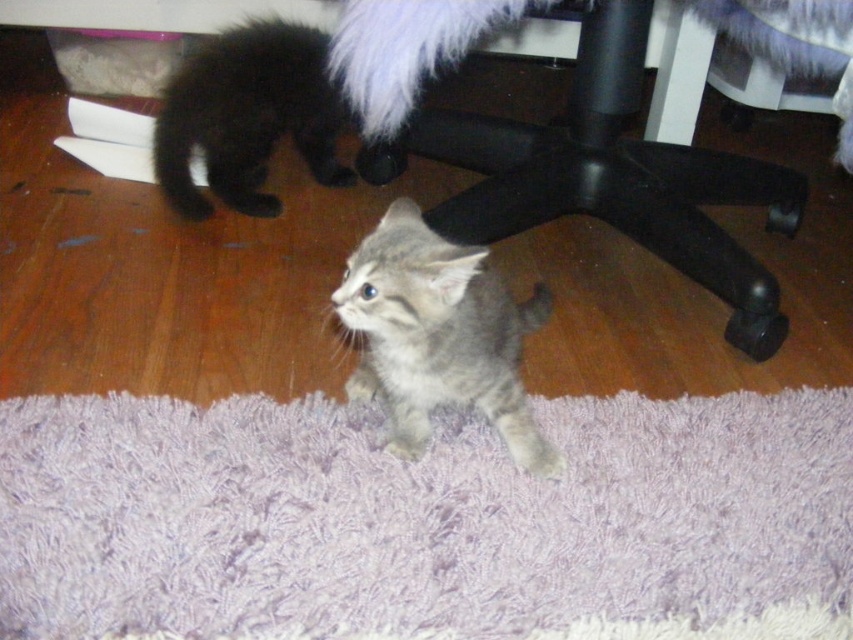
Does purple shaggy rug at center have a smaller size compared to gray tabby kitten at center?

No.

Who is positioned more to the left, purple shaggy rug at center or gray tabby kitten at center?

Positioned to the left is gray tabby kitten at center.

Describe the element at coordinates (418, 516) in the screenshot. The image size is (853, 640). I see `purple shaggy rug at center` at that location.

Locate an element on the screen. The width and height of the screenshot is (853, 640). purple shaggy rug at center is located at coordinates (418, 516).

Is purple shaggy rug at center wider than black plastic computer chair at lower center?

Correct, the width of purple shaggy rug at center exceeds that of black plastic computer chair at lower center.

Does purple shaggy rug at center appear over black plastic computer chair at lower center?

No.

Is point (97, 500) more distant than point (743, 339)?

No, (97, 500) is closer to viewer.

Identify the location of purple shaggy rug at center. (418, 516).

Is purple shaggy rug at center thinner than fluffy black kitten at upper left?

Incorrect, purple shaggy rug at center's width is not less than fluffy black kitten at upper left's.

Is point (263, 417) positioned in front of point (247, 200)?

Yes, it is.

This screenshot has width=853, height=640. I want to click on purple shaggy rug at center, so click(x=418, y=516).